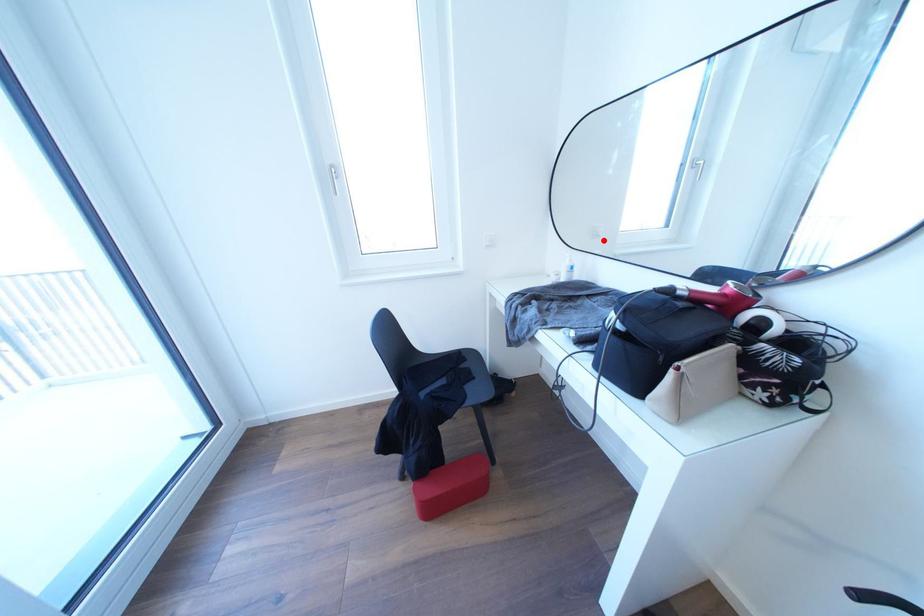
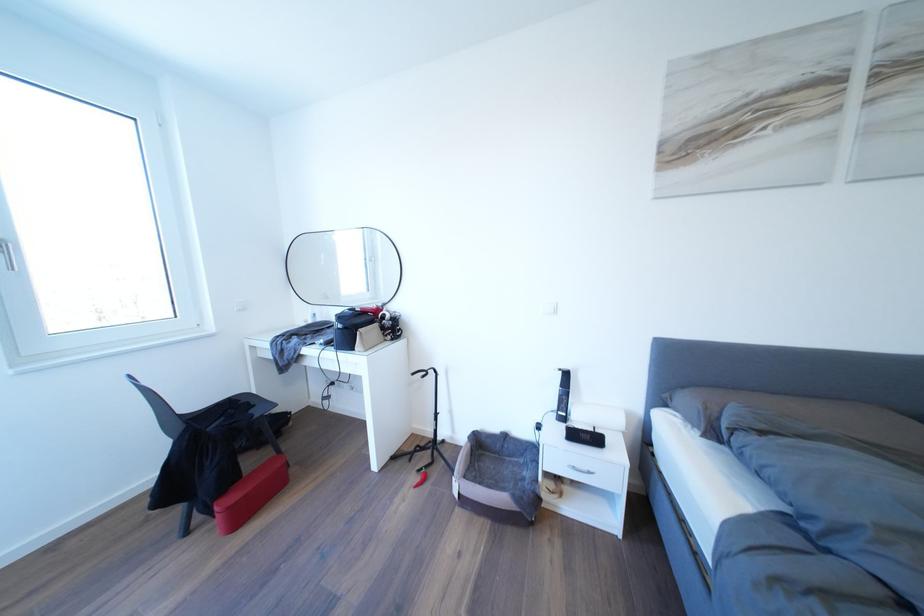
In the second image, find the point that corresponds to the highlighted location in the first image.

(334, 302)